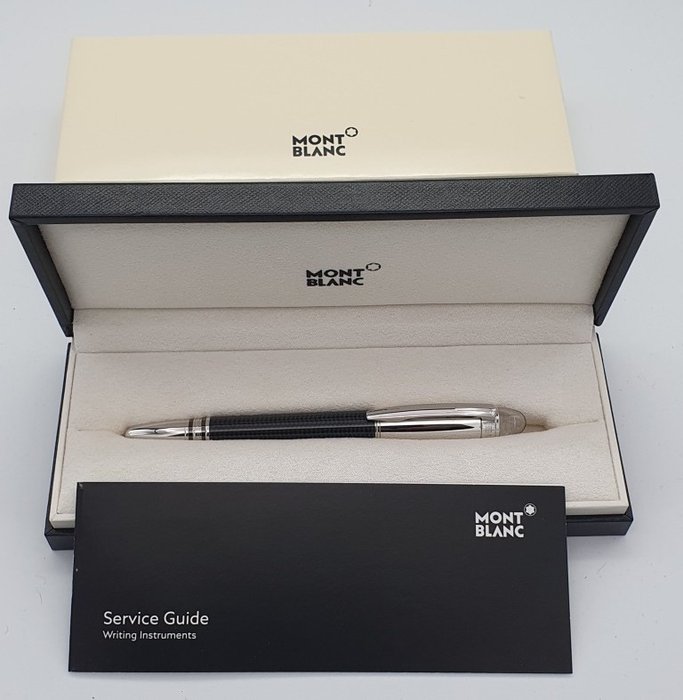
Find the location of `silver pen cap`. silver pen cap is located at coordinates (473, 426).